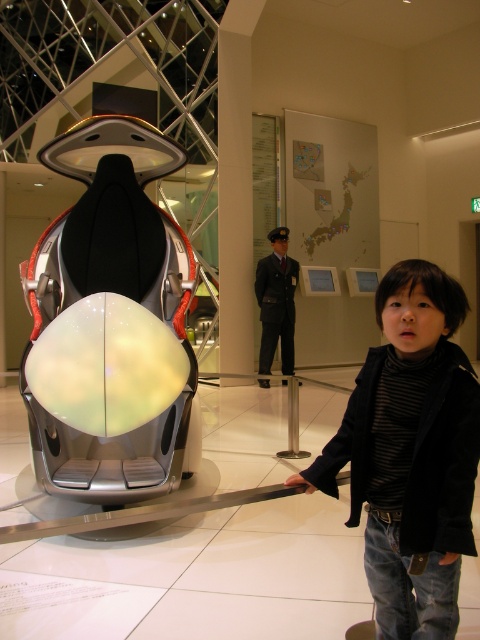
Question: Which point is closer to the camera?

Choices:
 (A) (167, 324)
 (B) (454, 440)

Answer: (B)

Question: Which object appears farthest from the camera in this image?

Choices:
 (A) glossy metallic seat at center
 (B) black turtleneck sweater at right

Answer: (A)

Question: Does glossy metallic seat at center appear under black turtleneck sweater at right?

Choices:
 (A) yes
 (B) no

Answer: (B)

Question: Is glossy metallic seat at center below black turtleneck sweater at right?

Choices:
 (A) yes
 (B) no

Answer: (B)

Question: Is glossy metallic seat at center in front of black turtleneck sweater at right?

Choices:
 (A) no
 (B) yes

Answer: (A)

Question: Among these objects, which one is farthest from the camera?

Choices:
 (A) glossy metallic seat at center
 (B) black turtleneck sweater at right

Answer: (A)